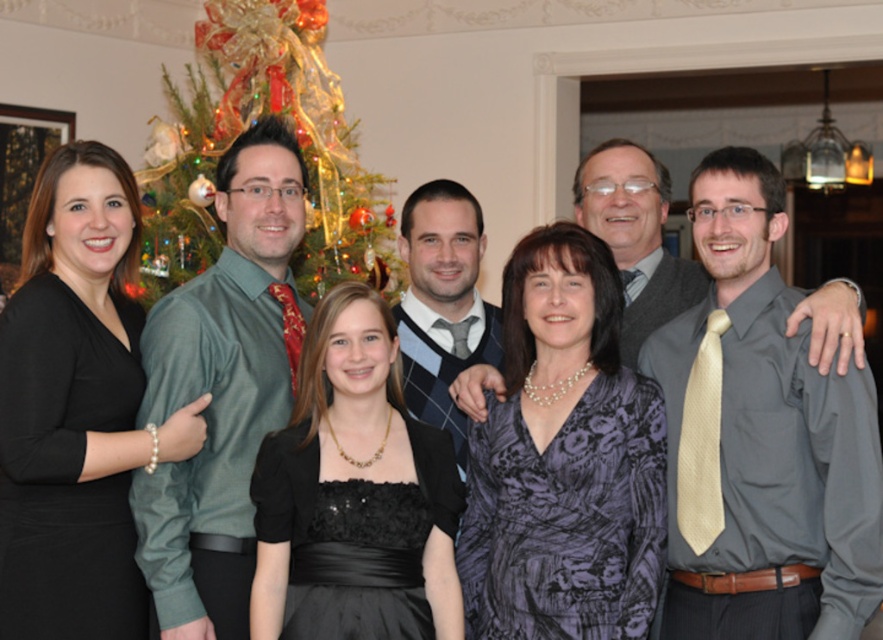
Question: Where is green satin shirt at left located in relation to light gray textured sweater at center in the image?

Choices:
 (A) above
 (B) below

Answer: (B)

Question: Which object is positioned closest to the black matte dress at left?

Choices:
 (A) black satin dress at center
 (B) silky gold tie at right
 (C) light gray textured sweater at center

Answer: (A)

Question: Which object appears farthest from the camera in this image?

Choices:
 (A) purple satin dress at center
 (B) silky gold tie at right
 (C) black satin dress at center
 (D) plaid sweater at center

Answer: (D)

Question: Is black matte dress at left bigger than decorated christmas tree at upper left?

Choices:
 (A) no
 (B) yes

Answer: (A)

Question: Where is silky gold tie at right located in relation to decorated christmas tree at upper left in the image?

Choices:
 (A) right
 (B) left

Answer: (A)

Question: Estimate the real-world distances between objects in this image. Which object is closer to the green satin shirt at left?

Choices:
 (A) silky gold tie at right
 (B) black satin dress at center
 (C) plaid sweater at center

Answer: (B)